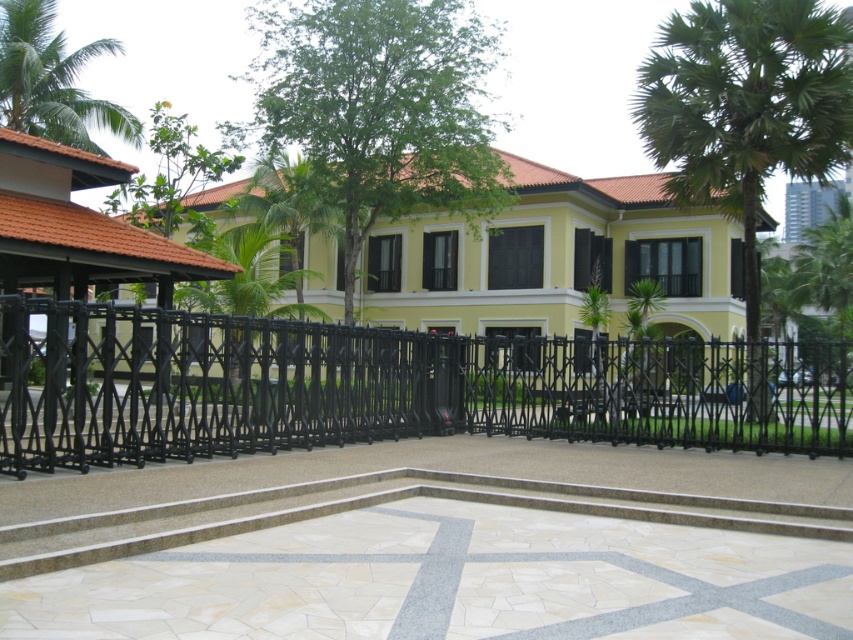
Question: Which object appears closest to the camera in this image?

Choices:
 (A) green leafy palm tree at upper left
 (B) black wrought iron gate at center
 (C) green leafy tree at upper center

Answer: (B)

Question: Is yellow matte building at center wider than matte orange roof at upper left?

Choices:
 (A) yes
 (B) no

Answer: (A)

Question: Which point appears farthest from the camera in this image?

Choices:
 (A) (28, 92)
 (B) (747, 140)
 (C) (717, 376)

Answer: (A)

Question: Is green leafy palm tree at upper right bigger than green leafy palm tree at upper left?

Choices:
 (A) no
 (B) yes

Answer: (B)

Question: Is black wrought iron gate at center to the right of green leafy palm tree at upper right from the viewer's perspective?

Choices:
 (A) no
 (B) yes

Answer: (A)

Question: Which point is farther to the camera?

Choices:
 (A) (90, 106)
 (B) (355, 35)
 (C) (178, 458)
 (D) (38, 166)

Answer: (A)